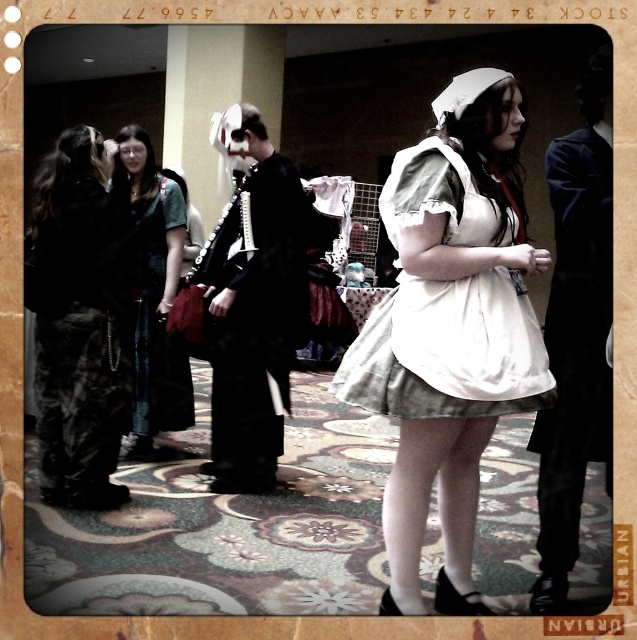
Question: Is camouflage pants at left thinner than black satin suit at center?

Choices:
 (A) yes
 (B) no

Answer: (A)

Question: Which point is farther from the camera taking this photo?

Choices:
 (A) (587, 420)
 (B) (222, 282)
 (C) (43, 291)
 (D) (161, 380)

Answer: (D)

Question: Can you confirm if white cotton dress at center is positioned above black satin suit at center?

Choices:
 (A) no
 (B) yes

Answer: (B)

Question: Considering the real-world distances, which object is farthest from the black satin suit at center?

Choices:
 (A) white cotton dress at center
 (B) camouflage pants at left
 (C) denim skirt at left
 (D) black velvet coat at right

Answer: (A)

Question: Is white cotton dress at center further to the viewer compared to camouflage pants at left?

Choices:
 (A) yes
 (B) no

Answer: (B)

Question: Which of these objects is positioned closest to the black velvet coat at right?

Choices:
 (A) camouflage pants at left
 (B) denim skirt at left
 (C) black satin suit at center
 (D) white cotton dress at center

Answer: (D)